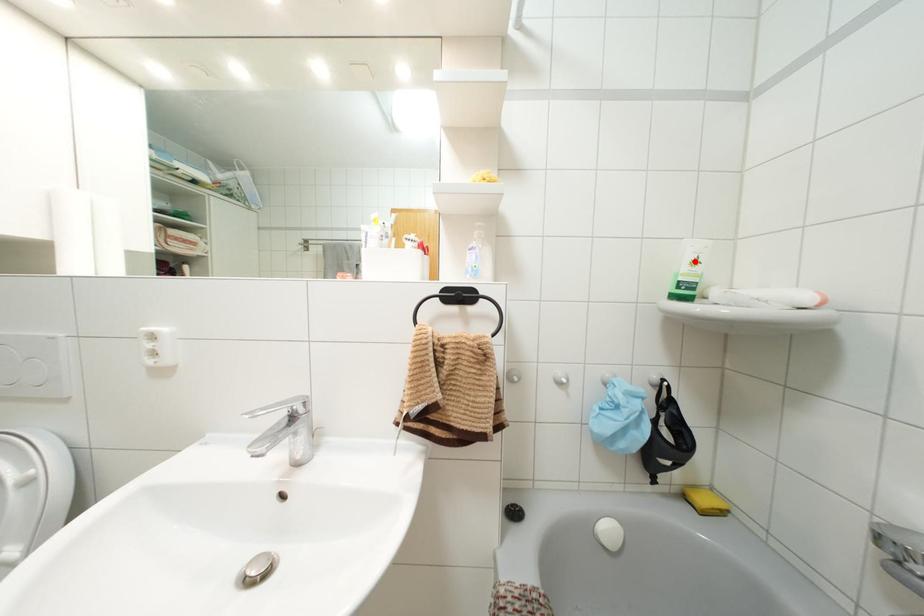
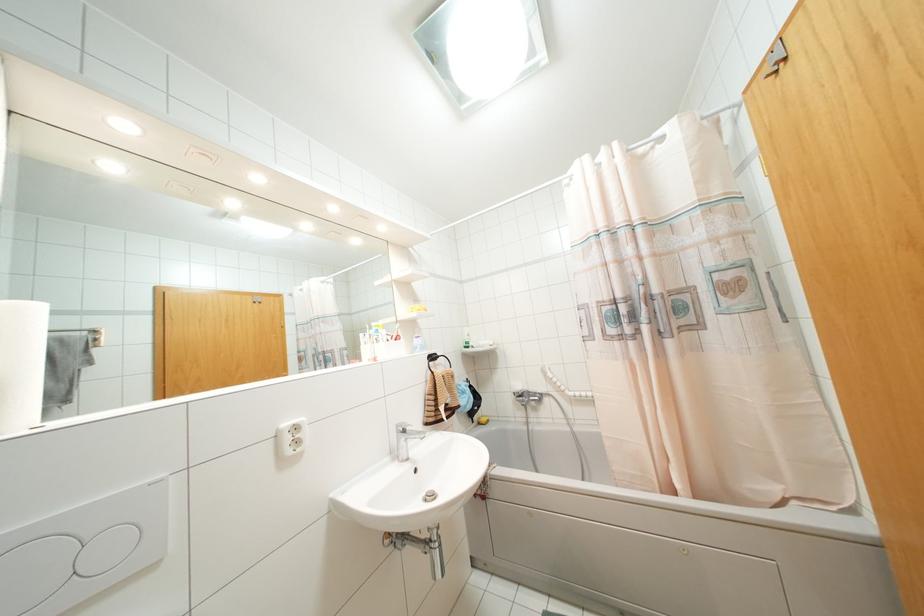
Locate, in the second image, the point that corresponds to the highlighted location in the first image.

(468, 334)